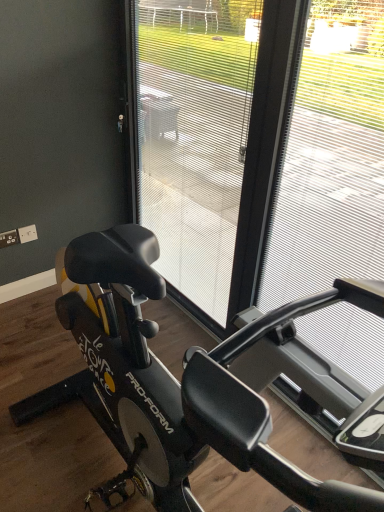
Question: Is metallic silver frame at right with black matte stationary bicycle at center?

Choices:
 (A) yes
 (B) no

Answer: (B)

Question: Considering the relative sizes of metallic silver frame at right and black matte stationary bicycle at center in the image provided, is metallic silver frame at right bigger than black matte stationary bicycle at center?

Choices:
 (A) yes
 (B) no

Answer: (A)

Question: Is metallic silver frame at right not near black matte stationary bicycle at center?

Choices:
 (A) no
 (B) yes

Answer: (B)

Question: Is metallic silver frame at right taller than black matte stationary bicycle at center?

Choices:
 (A) no
 (B) yes

Answer: (B)

Question: Is metallic silver frame at right oriented away from black matte stationary bicycle at center?

Choices:
 (A) no
 (B) yes

Answer: (A)

Question: Visually, is transparent plastic screen door at center positioned to the left or to the right of metallic silver frame at right?

Choices:
 (A) right
 (B) left

Answer: (B)

Question: From a real-world perspective, is transparent plastic screen door at center positioned above or below metallic silver frame at right?

Choices:
 (A) below
 (B) above

Answer: (A)

Question: Is transparent plastic screen door at center taller or shorter than metallic silver frame at right?

Choices:
 (A) tall
 (B) short

Answer: (B)

Question: In terms of size, does transparent plastic screen door at center appear bigger or smaller than metallic silver frame at right?

Choices:
 (A) big
 (B) small

Answer: (A)

Question: Considering the positions of black matte stationary bicycle at center and metallic silver frame at right in the image, is black matte stationary bicycle at center wider or thinner than metallic silver frame at right?

Choices:
 (A) wide
 (B) thin

Answer: (A)

Question: Relative to metallic silver frame at right, is black matte stationary bicycle at center in front or behind?

Choices:
 (A) behind
 (B) front

Answer: (A)

Question: Would you say black matte stationary bicycle at center is to the left or to the right of metallic silver frame at right in the picture?

Choices:
 (A) right
 (B) left

Answer: (B)

Question: From the image's perspective, is black matte stationary bicycle at center located above or below metallic silver frame at right?

Choices:
 (A) below
 (B) above

Answer: (A)

Question: Is transparent plastic screen door at center situated inside black matte stationary bicycle at center or outside?

Choices:
 (A) outside
 (B) inside

Answer: (A)

Question: Considering the relative positions of transparent plastic screen door at center and black matte stationary bicycle at center in the image provided, is transparent plastic screen door at center to the left or to the right of black matte stationary bicycle at center?

Choices:
 (A) right
 (B) left

Answer: (A)